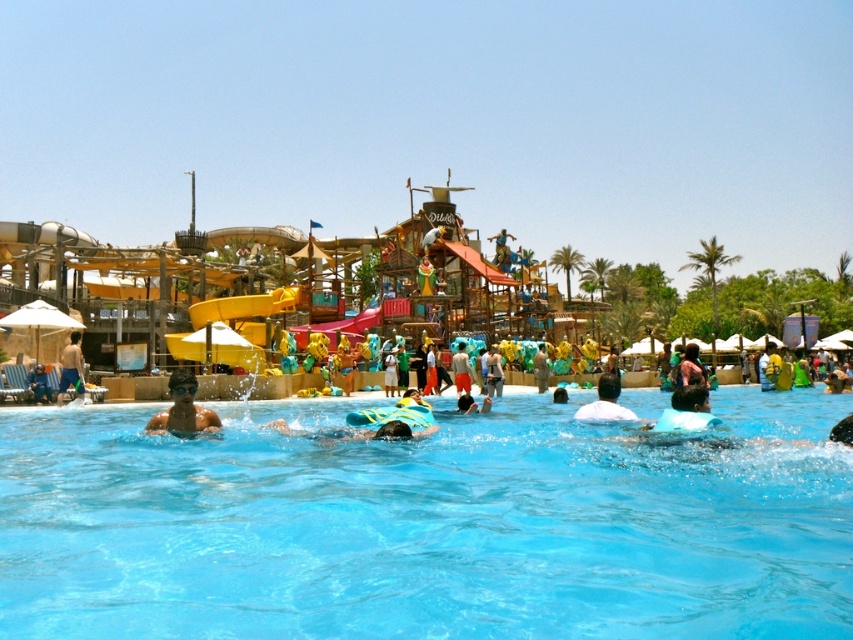
Looking at this image, you are a lifeguard standing at the edge of the pool and you see a swimmer with light brown skin at left and another swimmer wearing orange shorts at center. You need to reach both swimmers quickly. Which swimmer can you reach first if you swim directly towards them?

The light brown skin at left is closer to you than the orange shorts at center because they are 38.85 meters apart. Therefore, you can reach the light brown skin at left first.

Consider the image. You are a photographer at the water park and want to capture a photo that includes both the light brown skin at left and orange shorts at center. Since you want to highlight both subjects equally, which subject should you position closer to the camera to ensure they appear the same size in the photo?

Result: The light brown skin at left is wider than the orange shorts at center. To make them appear the same size in the photo, position the narrower orange shorts at center closer to the camera than the wider light brown skin at left.